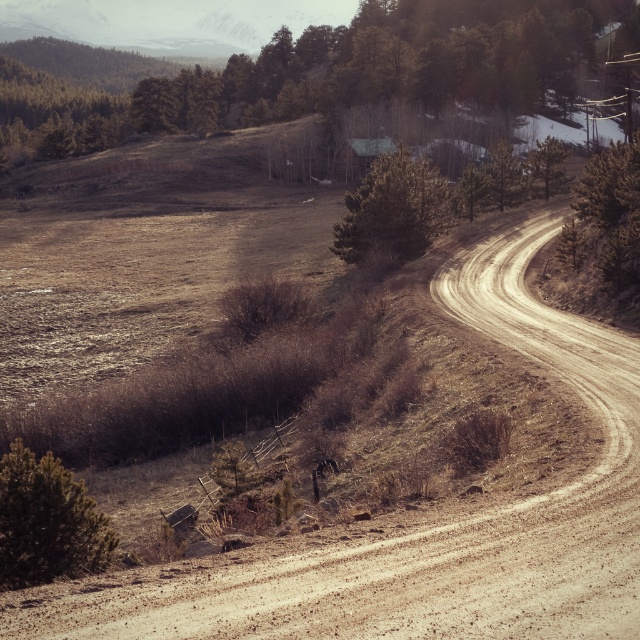
Question: Which object is farther from the camera taking this photo?

Choices:
 (A) green matte tree at lower left
 (B) green matte tree at upper center

Answer: (B)

Question: Which point is closer to the camera?

Choices:
 (A) green matte tree at lower left
 (B) brown dirt track at center-right

Answer: (B)

Question: Is green matte tree at upper center positioned behind green matte tree at lower left?

Choices:
 (A) no
 (B) yes

Answer: (B)

Question: Which point is closer to the camera?

Choices:
 (A) 32,580
 (B) 352,29
 (C) 406,236
 (D) 301,580

Answer: (D)

Question: Is green matte tree at upper center smaller than green matte tree at center?

Choices:
 (A) yes
 (B) no

Answer: (B)

Question: Can you confirm if green matte tree at lower left is positioned below green matte tree at center?

Choices:
 (A) no
 (B) yes

Answer: (B)